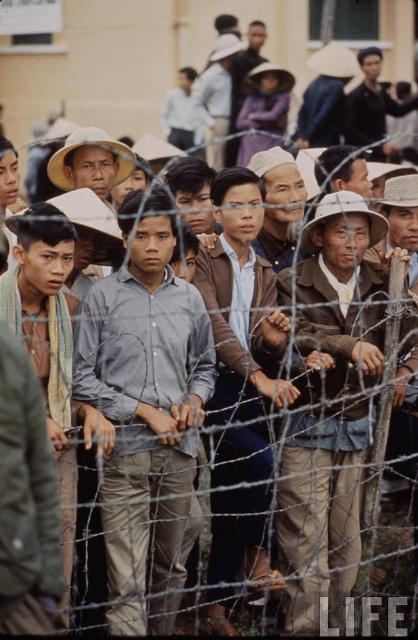
You are a tailor who needs to determine which jacket requires more fabric to make between the brown leather jacket at center and the dark green jacket at center. Based on the image, which one would need more fabric?

The brown leather jacket at center requires more fabric because its width is larger than the dark green jacket at center.

You are a photographer trying to capture a closeup of the barbed wire fence in the image. You notice a point at coordinates (242,305). What object is located at this point?

The point at coordinates (242,305) is on the brown leather jacket at center.

You are a photographer standing at the center of the scene. You want to take a photo of both the light brown fabric shirt at center and the brown leather jacket at center without moving either object. Can you capture both in a single frame without any obstruction from the barbed wire fence?

The light brown fabric shirt at center is 10.10 feet away from the brown leather jacket at center. Since the barbed wire fence is in the foreground and extends across the entire frame, it will obstruct the view between them, making it impossible to capture both in a single frame without obstruction.